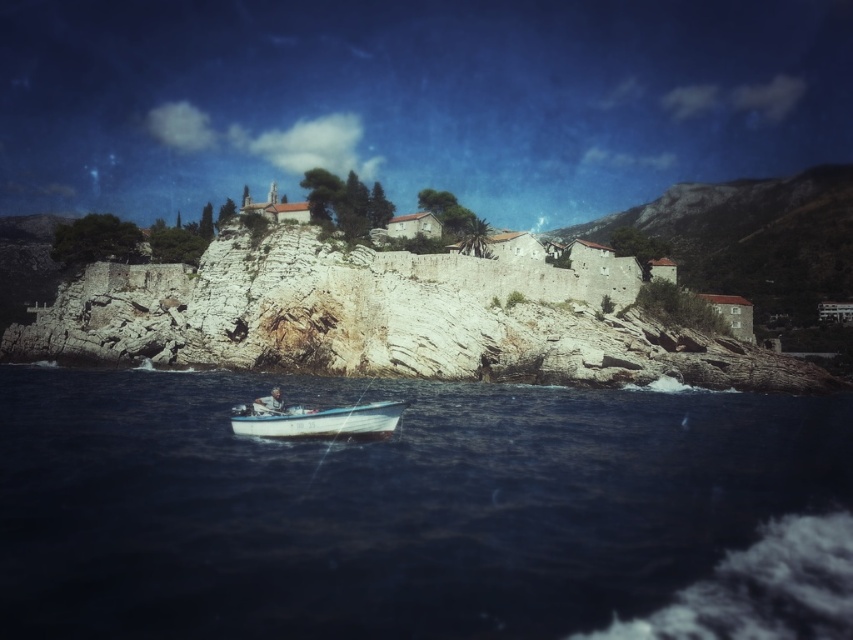
Who is positioned more to the right, blue water at lower center or white stone cliff at center?

blue water at lower center is more to the right.

Is point (570, 506) positioned after point (229, 346)?

That is False.

Is point (7, 611) positioned behind point (114, 362)?

No, (7, 611) is in front of (114, 362).

In order to click on blue water at lower center in this screenshot , I will do `click(421, 512)`.

Between white stone cliff at center and white matte boat at lower center, which one appears on the left side from the viewer's perspective?

Positioned to the left is white matte boat at lower center.

Who is taller, white stone cliff at center or white matte boat at lower center?

white stone cliff at center is taller.

Find the location of `white stone cliff at center`. white stone cliff at center is located at coordinates tap(374, 323).

Between white matte boat at lower center and white plastic boat at lower center, which one has less height?

With less height is white plastic boat at lower center.

Is white matte boat at lower center taller than white plastic boat at lower center?

Correct, white matte boat at lower center is much taller as white plastic boat at lower center.

Locate an element on the screen. The width and height of the screenshot is (853, 640). white matte boat at lower center is located at coordinates (315, 419).